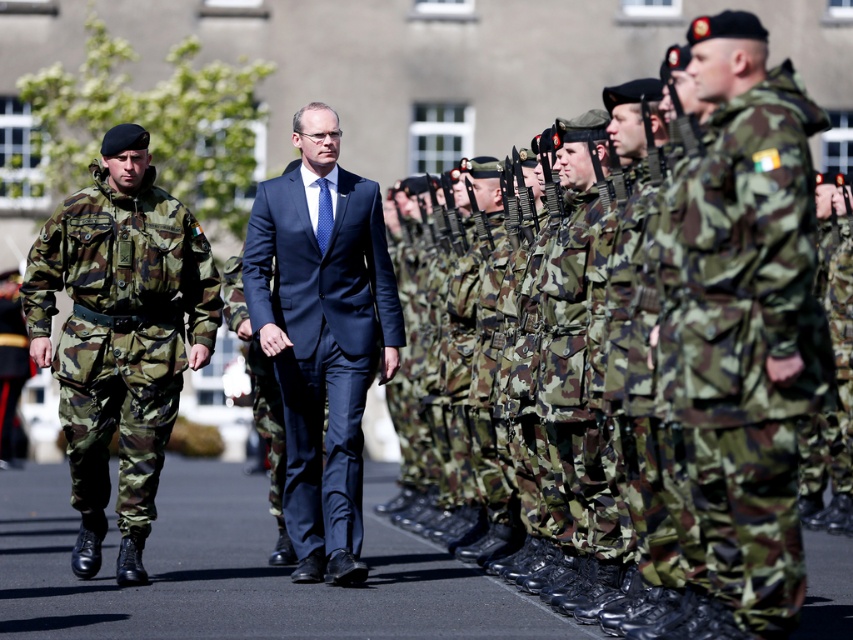
Question: Can you confirm if camouflage fabric uniform at left is wider than navy blue suit at center?

Choices:
 (A) no
 (B) yes

Answer: (B)

Question: Which of the following is the closest to the observer?

Choices:
 (A) camouflage fabric uniform at left
 (B) camouflage fabric uniform at center

Answer: (B)

Question: From the image, what is the correct spatial relationship of camouflage fabric uniform at center in relation to camouflage fabric uniform at left?

Choices:
 (A) left
 (B) right

Answer: (B)

Question: Which object is the closest to the camouflage fabric uniform at left?

Choices:
 (A) camouflage fabric uniform at center
 (B) navy blue suit at center

Answer: (B)

Question: Where is camouflage fabric uniform at center located in relation to camouflage fabric uniform at left in the image?

Choices:
 (A) above
 (B) below

Answer: (A)

Question: Which point appears farthest from the camera in this image?

Choices:
 (A) (329, 346)
 (B) (119, 509)

Answer: (A)